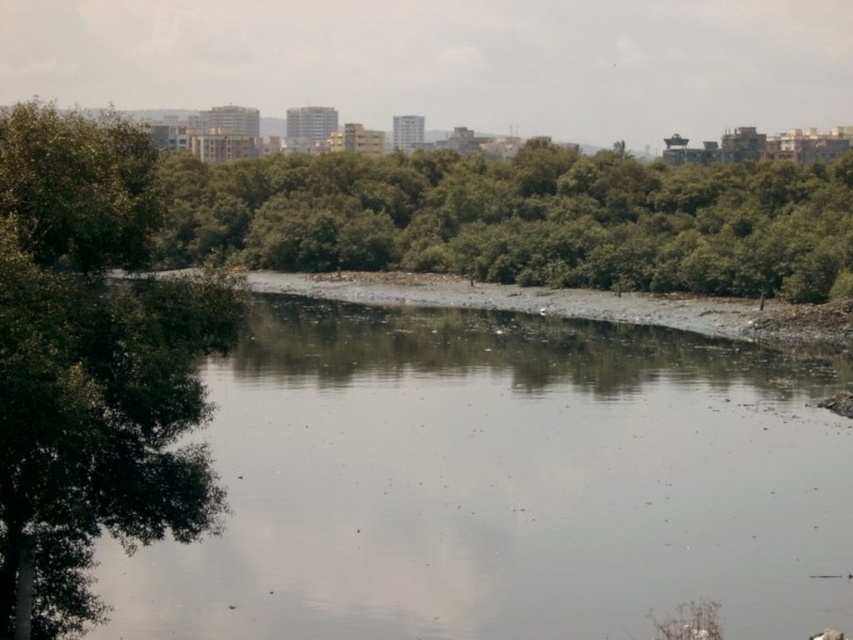
Is gray gravel river at center bigger than green leafy trees at center?

No.

Between point (666, 412) and point (379, 195), which one is positioned behind?

Point (379, 195)

Identify the location of gray gravel river at center. This screenshot has width=853, height=640. (500, 484).

Consider the image. Between gray gravel river at center and green leafy tree at left, which one is positioned higher?

gray gravel river at center

Consider the image. Does gray gravel river at center appear under green leafy tree at left?

Incorrect, gray gravel river at center is not positioned below green leafy tree at left.

Where is `gray gravel river at center`? This screenshot has width=853, height=640. gray gravel river at center is located at coordinates (500, 484).

I want to click on gray gravel river at center, so click(x=500, y=484).

Describe the element at coordinates (91, 364) in the screenshot. I see `green leafy tree at left` at that location.

Does green leafy tree at left appear on the right side of green leafy trees at center?

Incorrect, green leafy tree at left is not on the right side of green leafy trees at center.

Is point (189, 385) less distant than point (642, 252)?

Yes, it is in front of point (642, 252).

The width and height of the screenshot is (853, 640). Identify the location of green leafy tree at left. (91, 364).